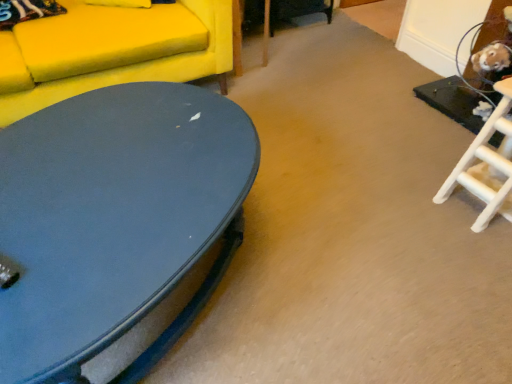
Identify the location of empty space that is ontop of matte blue coffee table at lower left (from a real-world perspective). (111, 169).